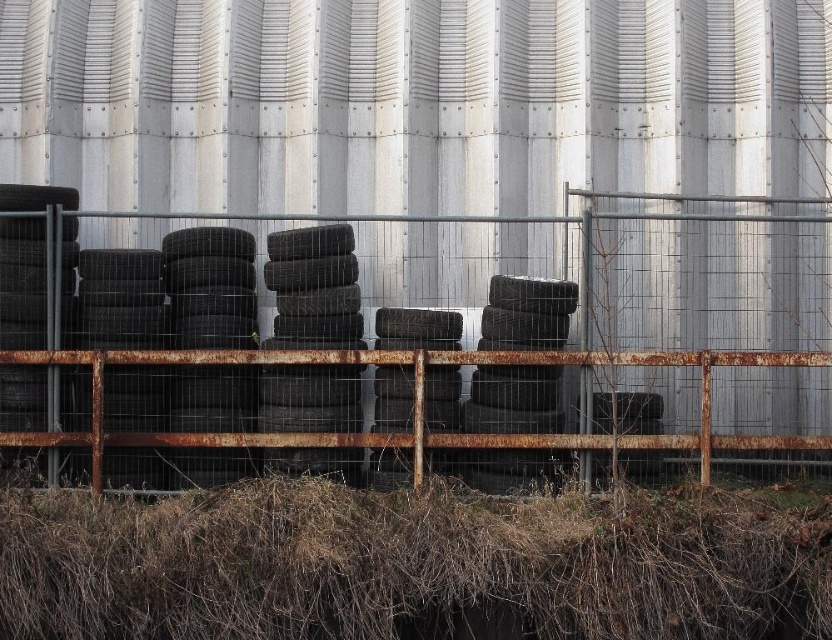
You are standing in front of the silo and notice a specific point marked at coordinates (504,336). Based on the scene description, what object is located at that point?

The point at coordinates (504,336) corresponds to the rusty metal fence at center.

You are standing in front of the silo and looking at the two points marked in the image. Which point, point (x=800, y=257) or point (x=132, y=570), is closer to you?

Point (x=800, y=257) is further to the viewer than point (x=132, y=570), so the point closer to you is point (x=132, y=570).

You are a farmer checking the condition of your property. You notice the rusty metal fence at center and the brown dry hay at bottom. Which object is taller?

The rusty metal fence at center is taller than the brown dry hay at bottom.